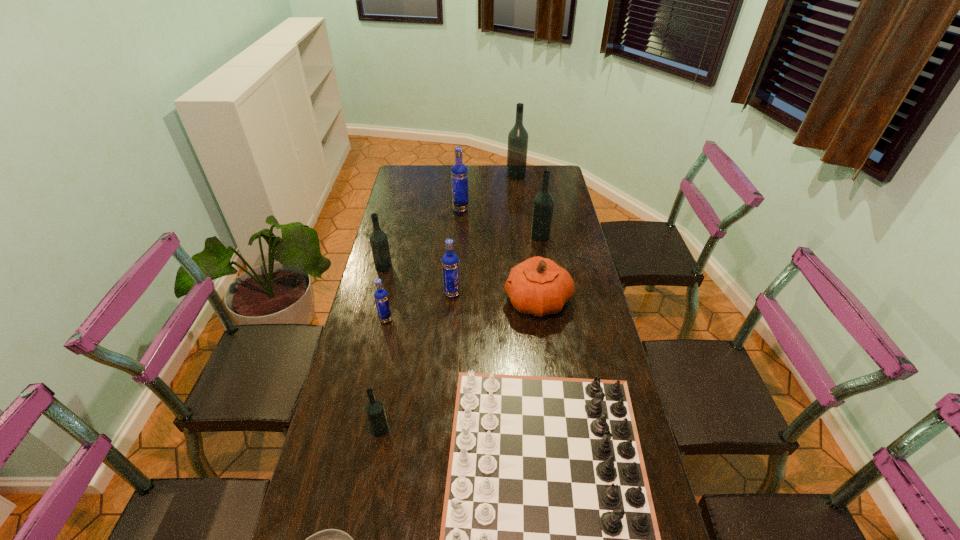
This screenshot has width=960, height=540. I want to click on free location located 0.380m on the front-facing side of the pumpkin, so click(x=397, y=301).

Find the location of a particular element. This screenshot has height=540, width=960. free point located on the front-facing side of the pumpkin is located at coordinates (479, 301).

What are the coordinates of `vacant region located 0.220m on the front-facing side of the pumpkin` in the screenshot? It's located at click(443, 301).

You are a GUI agent. You are given a task and a screenshot of the screen. Output one action in this format:
    pyautogui.click(x=<x>, y=<y>)
    Task: Click on the vacant space positioned on the front of the second nearest vodka
    
    Given the screenshot: What is the action you would take?
    pyautogui.click(x=361, y=435)

You are a GUI agent. You are given a task and a screenshot of the screen. Output one action in this format:
    pyautogui.click(x=<x>, y=<y>)
    Task: Click on the free space located 0.060m on the back of the smallest black vodka
    The image size is (960, 540).
    Given the screenshot: What is the action you would take?
    coord(385,402)

In order to click on object located in the far edge section of the desktop in this screenshot , I will do `click(518, 136)`.

Where is `vodka that is at the right edge`? Image resolution: width=960 pixels, height=540 pixels. vodka that is at the right edge is located at coordinates (543, 203).

You are a GUI agent. You are given a task and a screenshot of the screen. Output one action in this format:
    pyautogui.click(x=<x>, y=<y>)
    Task: Click on the pumpkin that is at the right edge
    This screenshot has width=960, height=540.
    Given the screenshot: What is the action you would take?
    pyautogui.click(x=538, y=286)

Image resolution: width=960 pixels, height=540 pixels. I want to click on free spot at the far edge of the desktop, so click(479, 165).

In the image, there is a desktop. Where is `vacant space at the left edge`? The image size is (960, 540). vacant space at the left edge is located at coordinates tap(401, 272).